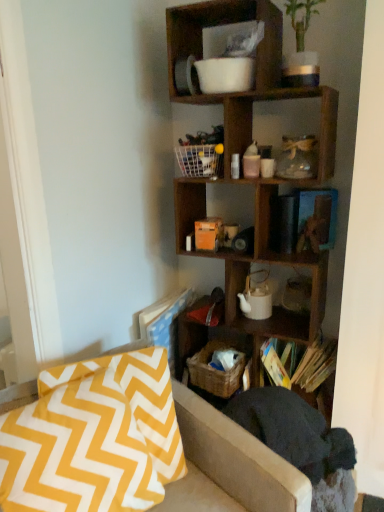
Question: Considering the relative sizes of woven brown basket at lower center and yellow zigzag fabric at lower left in the image provided, is woven brown basket at lower center taller than yellow zigzag fabric at lower left?

Choices:
 (A) yes
 (B) no

Answer: (B)

Question: Is woven brown basket at lower center facing away from yellow zigzag fabric at lower left?

Choices:
 (A) no
 (B) yes

Answer: (A)

Question: Is the depth of woven brown basket at lower center greater than that of yellow zigzag fabric at lower left?

Choices:
 (A) yes
 (B) no

Answer: (A)

Question: Are woven brown basket at lower center and yellow zigzag fabric at lower left far apart?

Choices:
 (A) no
 (B) yes

Answer: (A)

Question: Does woven brown basket at lower center have a smaller size compared to yellow zigzag fabric at lower left?

Choices:
 (A) no
 (B) yes

Answer: (B)

Question: Is woven brown basket at lower center placed right next to yellow zigzag fabric at lower left?

Choices:
 (A) no
 (B) yes

Answer: (A)

Question: Does wooden cube at upper right lie behind yellow zigzag fabric at lower left?

Choices:
 (A) no
 (B) yes

Answer: (B)

Question: Does wooden cube at upper right have a greater width compared to yellow zigzag fabric at lower left?

Choices:
 (A) no
 (B) yes

Answer: (A)

Question: Is wooden cube at upper right oriented away from yellow zigzag fabric at lower left?

Choices:
 (A) yes
 (B) no

Answer: (B)

Question: From the image's perspective, is wooden cube at upper right on yellow zigzag fabric at lower left?

Choices:
 (A) yes
 (B) no

Answer: (A)

Question: From a real-world perspective, is wooden cube at upper right over yellow zigzag fabric at lower left?

Choices:
 (A) no
 (B) yes

Answer: (B)

Question: Is yellow zigzag fabric at lower left a part of wooden cube at upper right?

Choices:
 (A) yes
 (B) no

Answer: (B)

Question: Is dark gray fabric swivel chair at lower right taller than woven brown basket at lower center?

Choices:
 (A) no
 (B) yes

Answer: (B)